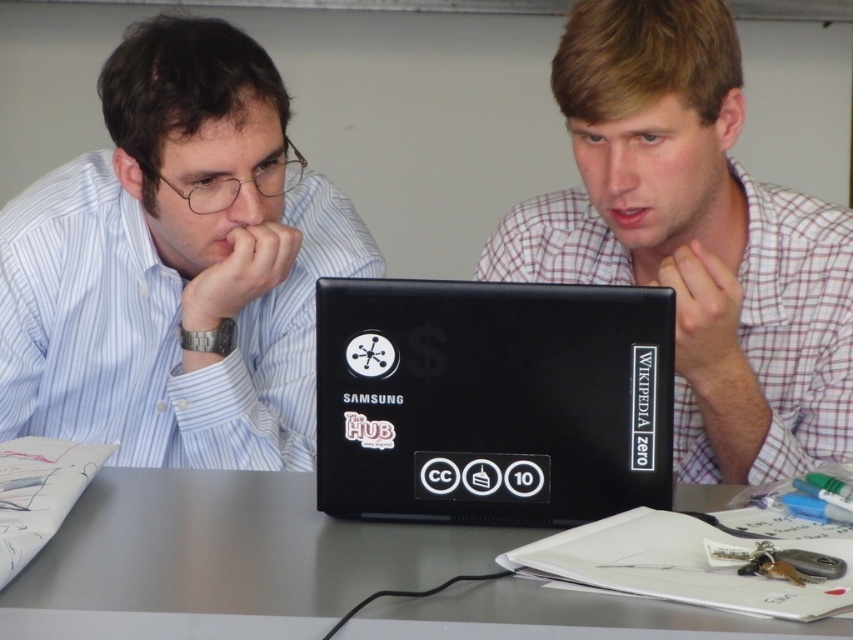
Is point (659, 419) farther from viewer compared to point (94, 528)?

That is False.

Is black matte laptop at center further to the viewer compared to metallic gray table at center?

That is True.

What do you see at coordinates (492, 401) in the screenshot?
I see `black matte laptop at center` at bounding box center [492, 401].

The height and width of the screenshot is (640, 853). Identify the location of black matte laptop at center. (492, 401).

Which is behind, point (630, 24) or point (595, 490)?

Point (630, 24)

The image size is (853, 640). Identify the location of plaid shirt at center. (695, 237).

Between plaid shirt at center and metallic gray table at center, which one appears on the left side from the viewer's perspective?

metallic gray table at center

Is the position of plaid shirt at center more distant than that of metallic gray table at center?

That is True.

In order to click on plaid shirt at center in this screenshot , I will do `click(695, 237)`.